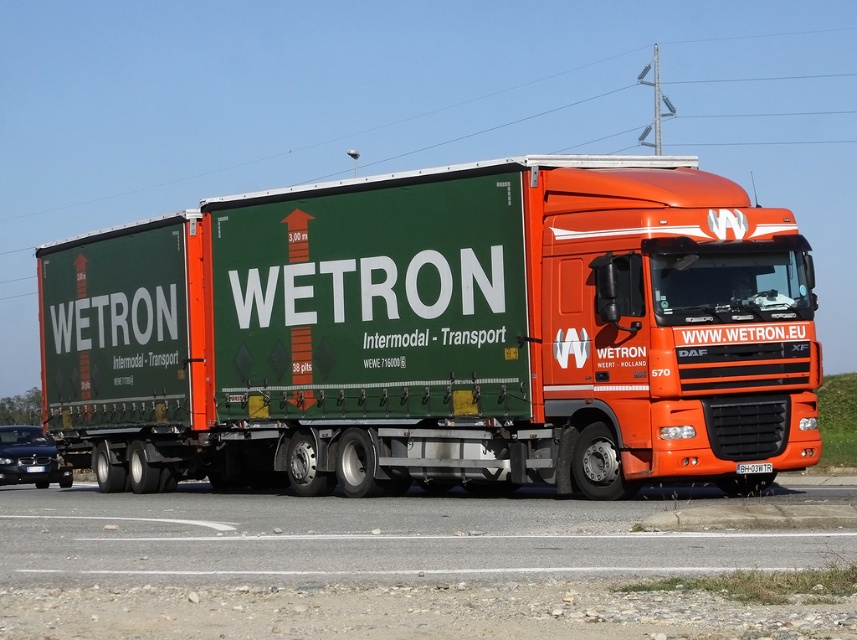
Question: Is shiny black sedan at lower left closer to camera compared to red plastic license plate at center?

Choices:
 (A) no
 (B) yes

Answer: (A)

Question: Which object is the closest to the black plastic license plate at center?

Choices:
 (A) shiny black sedan at lower left
 (B) green fabric trailer truck at center
 (C) red plastic license plate at center

Answer: (A)

Question: Which point is farther to the camera?

Choices:
 (A) (213, 342)
 (B) (25, 467)
 (C) (30, 445)
 (D) (769, 468)

Answer: (C)

Question: Which of the following is the farthest from the observer?

Choices:
 (A) (37, 467)
 (B) (376, 483)
 (C) (763, 461)
 (D) (6, 426)

Answer: (D)

Question: Considering the relative positions of green fabric trailer truck at center and black plastic license plate at center in the image provided, where is green fabric trailer truck at center located with respect to black plastic license plate at center?

Choices:
 (A) left
 (B) right

Answer: (B)

Question: Is shiny black sedan at lower left positioned behind black plastic license plate at center?

Choices:
 (A) no
 (B) yes

Answer: (A)